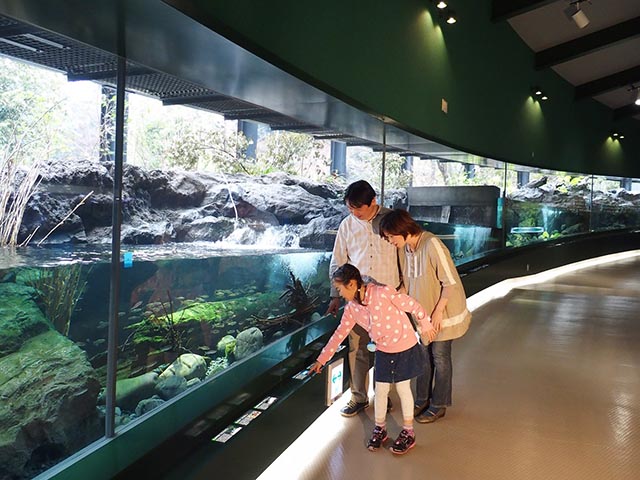
At what (x,y) coordinates should I click in order to perform the action: click on plate glass. Please return your answer as a coordinate pair (x, y). Looking at the image, I should click on (33, 280), (168, 212), (459, 182), (576, 202), (623, 198).